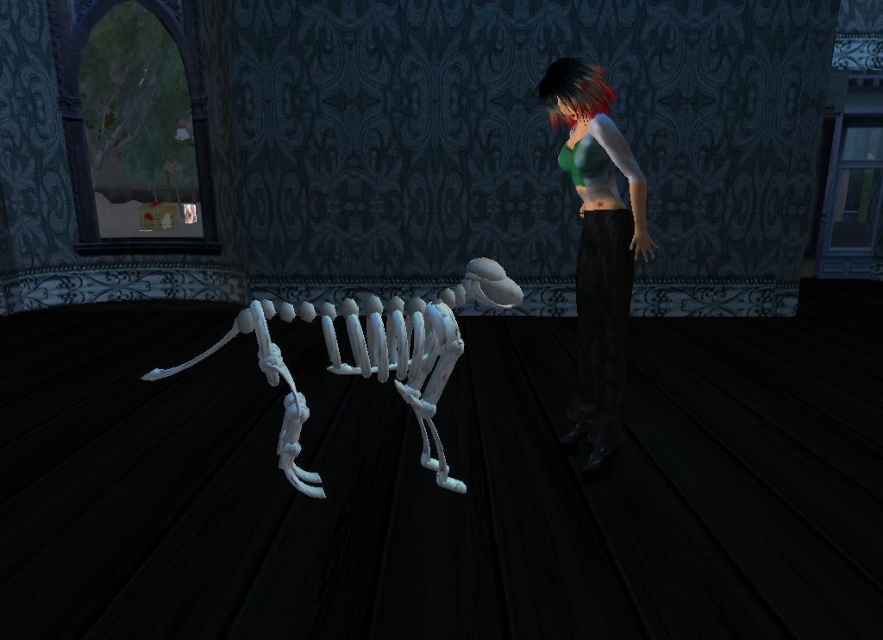
You are standing in the room and see the skeletal figure and the character with short dark hair. There is a green matte shirt at center located at point [597,244]. If you want to place a small object exactly at that point, which object from the scene would be the best reference to ensure accuracy?

The green matte shirt at center located at point [597,244] is the best reference since it is precisely at that coordinate.

You are a detective examining the scene. You notice the green matte shirt at center and the shiny dark hair at upper center. Which object is closer to you, the observer?

The green matte shirt at center is closer to you because it is in front of the shiny dark hair at upper center.